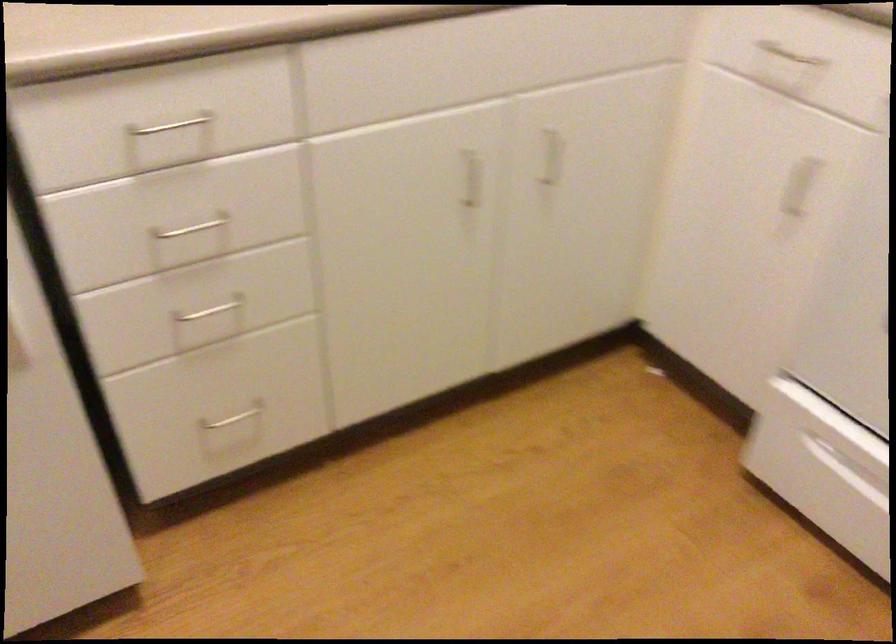
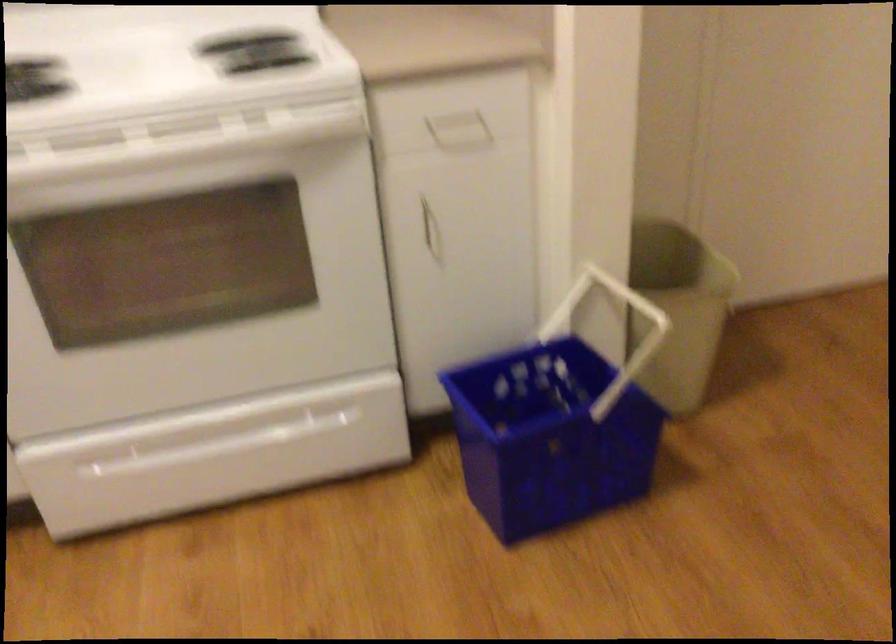
Question: How did the camera likely rotate?

Choices:
 (A) Left
 (B) Right
 (C) Up
 (D) Down

Answer: (B)